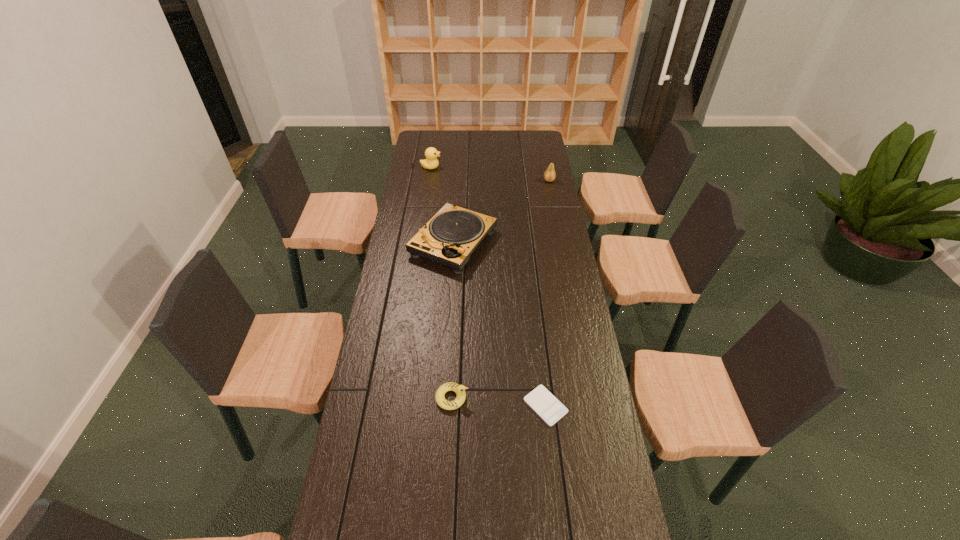
Locate an element on the screen. This screenshot has height=540, width=960. the closest object to the farthest object is located at coordinates (449, 238).

Identify the location of free space that satisfies the following two spatial constraints: 1. on the front side of the rightmost object; 2. on the face of the second shortest object. The image size is (960, 540). (x=593, y=398).

Find the location of `free spot that satisfies the following two spatial constraints: 1. on the face of the third farthest object; 2. on the left side of the duck`. free spot that satisfies the following two spatial constraints: 1. on the face of the third farthest object; 2. on the left side of the duck is located at coordinates (420, 243).

I want to click on vacant region that satisfies the following two spatial constraints: 1. on the face of the duck; 2. on the back side of the third farthest object, so click(420, 243).

In order to click on blank space that satisfies the following two spatial constraints: 1. on the face of the duck; 2. on the right side of the third farthest object in this screenshot , I will do coord(420,243).

Find the location of `free space that satisfies the following two spatial constraints: 1. on the back side of the rightmost object; 2. on the left side of the second object from right to left`. free space that satisfies the following two spatial constraints: 1. on the back side of the rightmost object; 2. on the left side of the second object from right to left is located at coordinates (519, 180).

You are a GUI agent. You are given a task and a screenshot of the screen. Output one action in this format:
    pyautogui.click(x=<x>, y=<y>)
    Task: Click on the free location that satisfies the following two spatial constraints: 1. on the back side of the calculator; 2. on the face of the duck
    The height and width of the screenshot is (540, 960).
    Given the screenshot: What is the action you would take?
    pyautogui.click(x=518, y=167)

Where is `vacant space that satisfies the following two spatial constraints: 1. on the back side of the calculator; 2. on the left side of the rightmost object`? The width and height of the screenshot is (960, 540). vacant space that satisfies the following two spatial constraints: 1. on the back side of the calculator; 2. on the left side of the rightmost object is located at coordinates (519, 180).